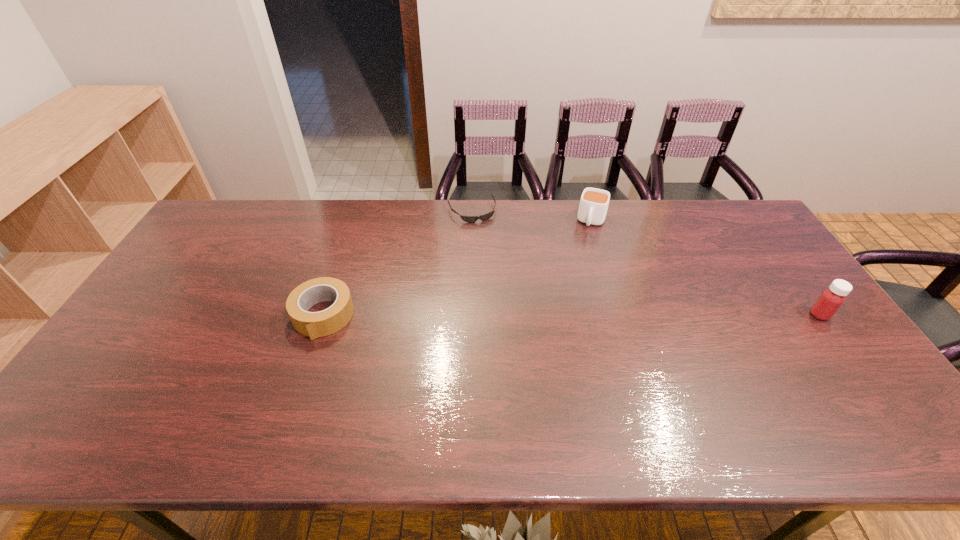
The image size is (960, 540). What are the coordinates of `free space on the desktop that is between the duct tape and the tallest object and is positioned on the side with the handle of the third object from left to right` in the screenshot? It's located at (561, 315).

This screenshot has height=540, width=960. In order to click on free space on the desktop that is between the third tallest object and the tallest object and is positioned on the front-facing side of the third object from right to left in this screenshot , I will do `click(516, 315)`.